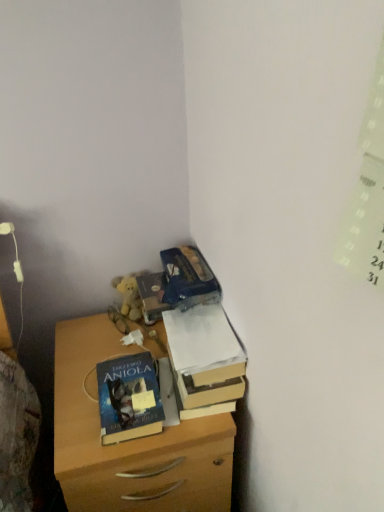
Where is `blank space situated above blue matte book at center (from a real-world perspective)`? This screenshot has width=384, height=512. blank space situated above blue matte book at center (from a real-world perspective) is located at coordinates (128, 385).